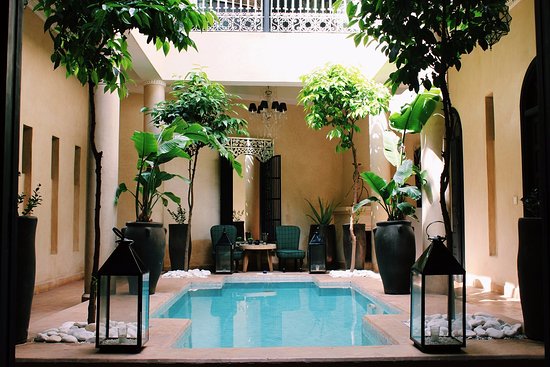
Identify the location of left green chair beside stool. (223, 232).